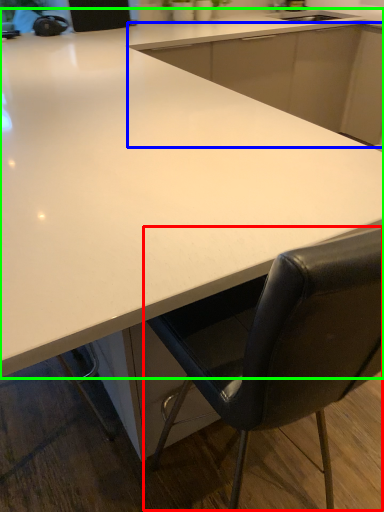
Question: Based on their relative distances, which object is nearer to chair (highlighted by a red box)? Choose from cabinetry (highlighted by a blue box) and countertop (highlighted by a green box).

Choices:
 (A) cabinetry
 (B) countertop

Answer: (B)